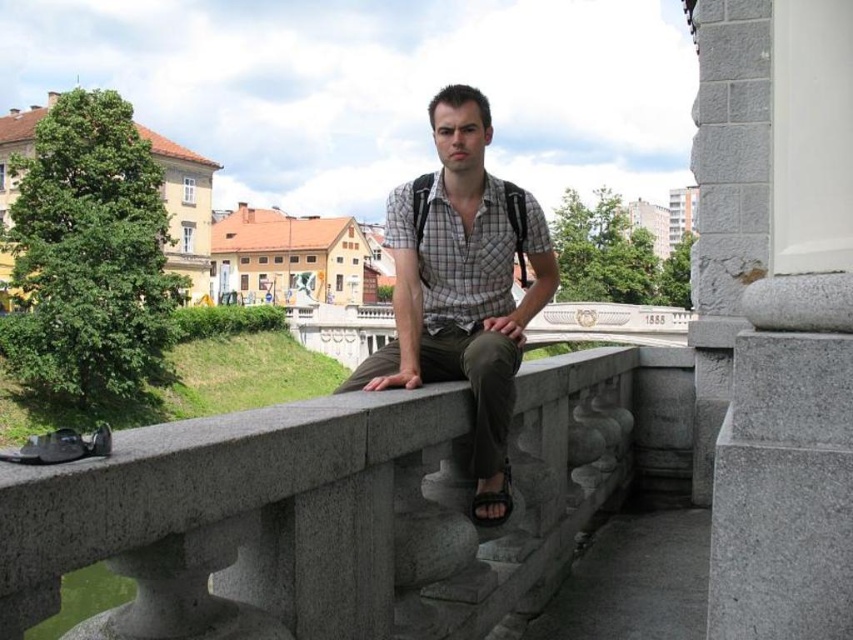
Which is below, checkered fabric shirt at center or black leather sandal at lower center?

black leather sandal at lower center is lower down.

Is checkered fabric shirt at center thinner than black leather sandal at lower center?

Incorrect, checkered fabric shirt at center's width is not less than black leather sandal at lower center's.

Does point (444, 288) come farther from viewer compared to point (492, 502)?

That is True.

Where is `checkered fabric shirt at center`? The width and height of the screenshot is (853, 640). checkered fabric shirt at center is located at coordinates (461, 278).

Which is behind, point (236, 552) or point (480, 497)?

The point (480, 497) is more distant.

Is point (422, 486) less distant than point (505, 470)?

Yes, it is.

Does point (335, 600) lie in front of point (474, 506)?

Yes, it is in front of point (474, 506).

Image resolution: width=853 pixels, height=640 pixels. In order to click on gray stone rail at center in this screenshot , I will do `click(318, 513)`.

Is gray stone rail at center further to the viewer compared to checkered fabric shirt at center?

No.

Who is more distant from viewer, (x=235, y=467) or (x=553, y=264)?

The point (x=553, y=264) is behind.

The width and height of the screenshot is (853, 640). Describe the element at coordinates (318, 513) in the screenshot. I see `gray stone rail at center` at that location.

At what (x,y) coordinates should I click in order to perform the action: click on gray stone rail at center. Please return your answer as a coordinate pair (x, y). Image resolution: width=853 pixels, height=640 pixels. Looking at the image, I should click on (318, 513).